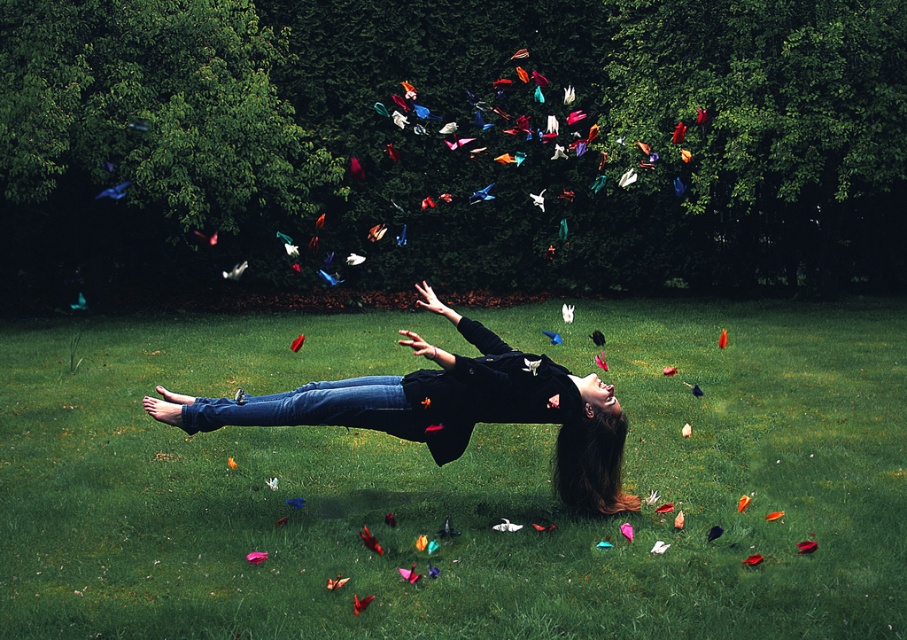
You are standing in the surreal grassy field scene and want to place a small statue on the ground where it will be visible without being blocked. Which object should you choose to place it in front of, the green grass at center or the matte black jacket at center?

The green grass at center is in front of the matte black jacket at center. To ensure the statue is visible without being blocked, place it in front of the matte black jacket at center since the green grass is already in front and would block the statue.

How far apart are the green grass at center and the person lying horizontally on the ground?

The green grass at center and the person lying horizontally on the ground are 16.46 feet apart.